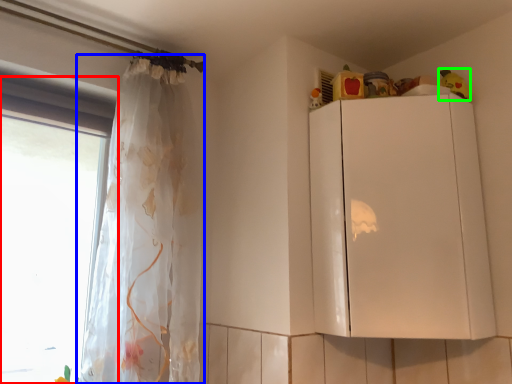
Question: Which is farther away from window (highlighted by a red box)? curtain (highlighted by a blue box) or toy (highlighted by a green box)?

Choices:
 (A) curtain
 (B) toy

Answer: (B)